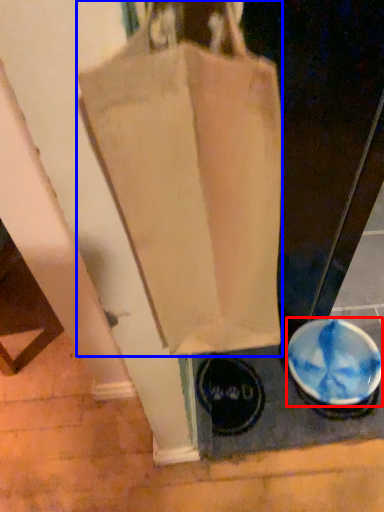
Question: Among these objects, which one is nearest to the camera, bowl (highlighted by a red box) or handbag (highlighted by a blue box)?

Choices:
 (A) bowl
 (B) handbag

Answer: (B)